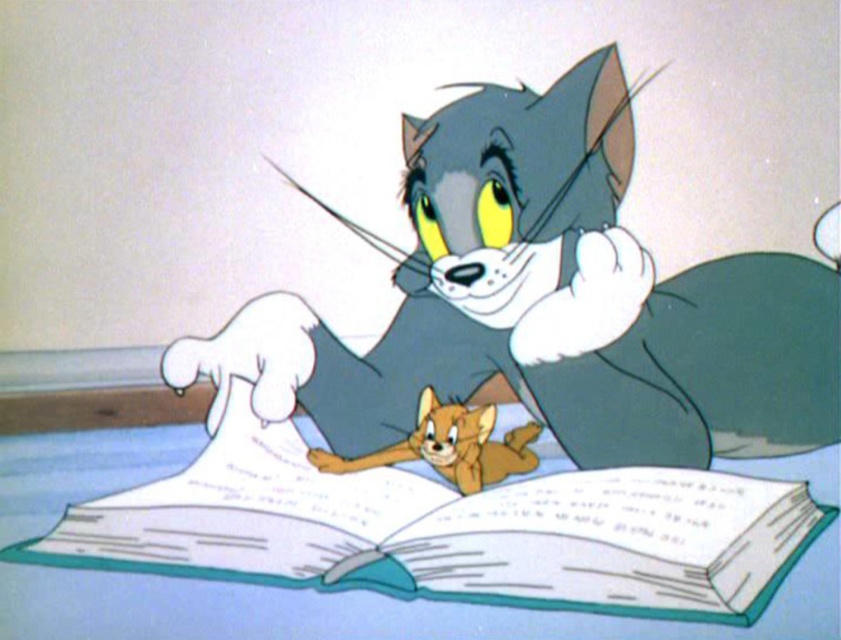
Question: Which object is positioned farthest from the orange fur cat at center?

Choices:
 (A) gray fur cat at center
 (B) white paper book at center

Answer: (A)

Question: Does gray fur cat at center appear on the right side of white paper book at center?

Choices:
 (A) yes
 (B) no

Answer: (A)

Question: Based on their relative distances, which object is nearer to the gray fur cat at center?

Choices:
 (A) orange fur cat at center
 (B) white paper book at center

Answer: (A)

Question: Is the position of white paper book at center less distant than that of orange fur cat at center?

Choices:
 (A) yes
 (B) no

Answer: (A)

Question: Which of the following is the farthest from the observer?

Choices:
 (A) (474, 436)
 (B) (799, 365)
 (C) (274, 474)

Answer: (A)

Question: Is gray fur cat at center bigger than orange fur cat at center?

Choices:
 (A) yes
 (B) no

Answer: (A)